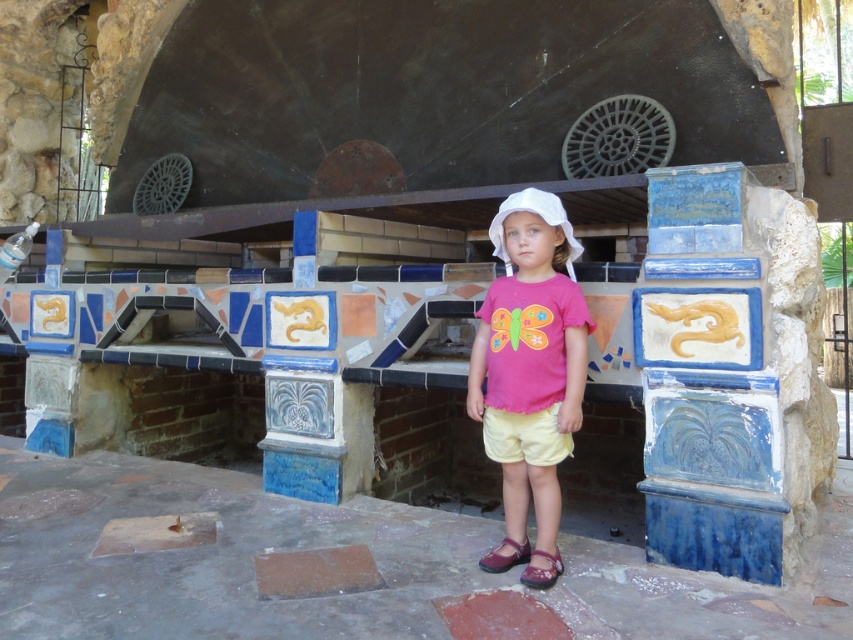
Question: Is pink fabric shirt at center above yellow cotton shorts at center?

Choices:
 (A) no
 (B) yes

Answer: (B)

Question: Which point is closer to the camera?

Choices:
 (A) yellow cotton shorts at center
 (B) pink fabric shirt at center

Answer: (B)

Question: Can you confirm if pink fabric shirt at center is positioned to the left of yellow cotton shorts at center?

Choices:
 (A) yes
 (B) no

Answer: (A)

Question: Among these objects, which one is nearest to the camera?

Choices:
 (A) pink fabric shirt at center
 (B) yellow cotton shorts at center

Answer: (A)

Question: Can you confirm if pink fabric shirt at center is thinner than yellow cotton shorts at center?

Choices:
 (A) no
 (B) yes

Answer: (A)